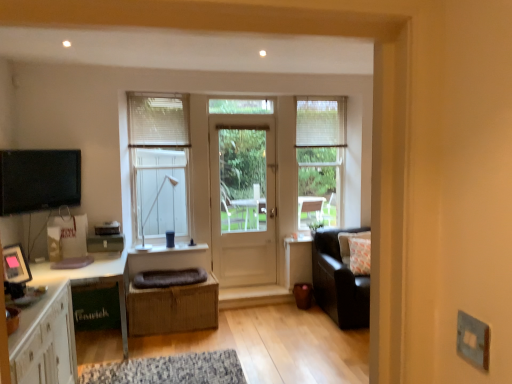
Question: From the image's perspective, would you say brown woven crate at center is positioned over matte white lamp at upper center?

Choices:
 (A) yes
 (B) no

Answer: (B)

Question: Could you tell me if brown woven crate at center is turned towards matte white lamp at upper center?

Choices:
 (A) yes
 (B) no

Answer: (B)

Question: Is the position of brown woven crate at center more distant than that of matte white lamp at upper center?

Choices:
 (A) yes
 (B) no

Answer: (B)

Question: Is brown woven crate at center thinner than matte white lamp at upper center?

Choices:
 (A) yes
 (B) no

Answer: (B)

Question: Can you confirm if brown woven crate at center is positioned to the left of matte white lamp at upper center?

Choices:
 (A) no
 (B) yes

Answer: (A)

Question: From the image's perspective, relative to matte black tv at left, is white fabric curtain at upper center, which is the 2th curtain from front to back, above or below?

Choices:
 (A) below
 (B) above

Answer: (B)

Question: Would you say white fabric curtain at upper center, which is the 2th curtain from front to back, is to the left or to the right of matte black tv at left in the picture?

Choices:
 (A) left
 (B) right

Answer: (B)

Question: Is white fabric curtain at upper center, the 1th curtain viewed from the back, taller or shorter than matte black tv at left?

Choices:
 (A) tall
 (B) short

Answer: (B)

Question: Looking at the image, does white fabric curtain at upper center, which is the 2th curtain from front to back, seem bigger or smaller compared to matte black tv at left?

Choices:
 (A) big
 (B) small

Answer: (B)

Question: From the image's perspective, is white fabric curtain at upper center, the 1th curtain viewed from the back, above or below matte white lamp at upper center?

Choices:
 (A) below
 (B) above

Answer: (B)

Question: Is white fabric curtain at upper center, which is the 2th curtain from front to back, taller or shorter than matte white lamp at upper center?

Choices:
 (A) tall
 (B) short

Answer: (B)

Question: In terms of size, does white fabric curtain at upper center, the 1th curtain viewed from the back, appear bigger or smaller than matte white lamp at upper center?

Choices:
 (A) small
 (B) big

Answer: (A)

Question: Considering their positions, is white fabric curtain at upper center, marked as the first curtain in a right-to-left arrangement, located in front of or behind matte white lamp at upper center?

Choices:
 (A) front
 (B) behind

Answer: (B)

Question: Looking at their shapes, would you say white fabric curtain at upper center, positioned as the second curtain in left-to-right order, is wider or thinner than white glossy cabinet at lower left?

Choices:
 (A) thin
 (B) wide

Answer: (A)

Question: Is point (315, 144) positioned closer to the camera than point (58, 284)?

Choices:
 (A) farther
 (B) closer

Answer: (A)